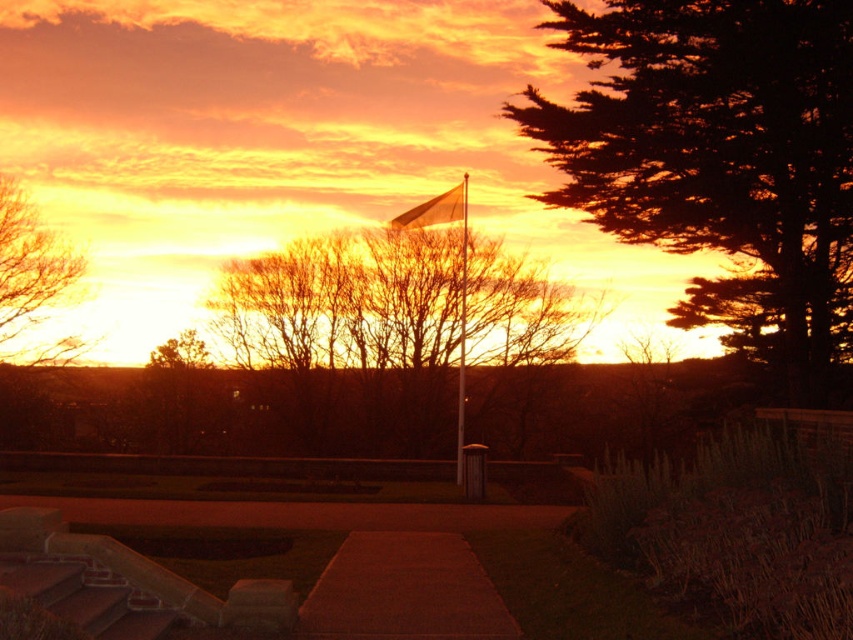
You are standing at the point marked by the coordinates point (720, 160). Looking around, you see a silhouette evergreen tree at right. Where is the silhouette evergreen tree relative to your current position?

The silhouette evergreen tree at right is located at the point marked by your current position, which is point (720, 160).

You are an artist setting up your easel to paint the sunset scene. You want to ensure both the brown leafless tree at upper left and the metallic flag pole at center are visible in your painting. Given their sizes, which object should you focus on placing first to ensure it doesn

The brown leafless tree at upper left occupies less space than the metallic flag pole at center, so you should focus on placing the metallic flag pole at center first to ensure it fits properly before adding the smaller tree.